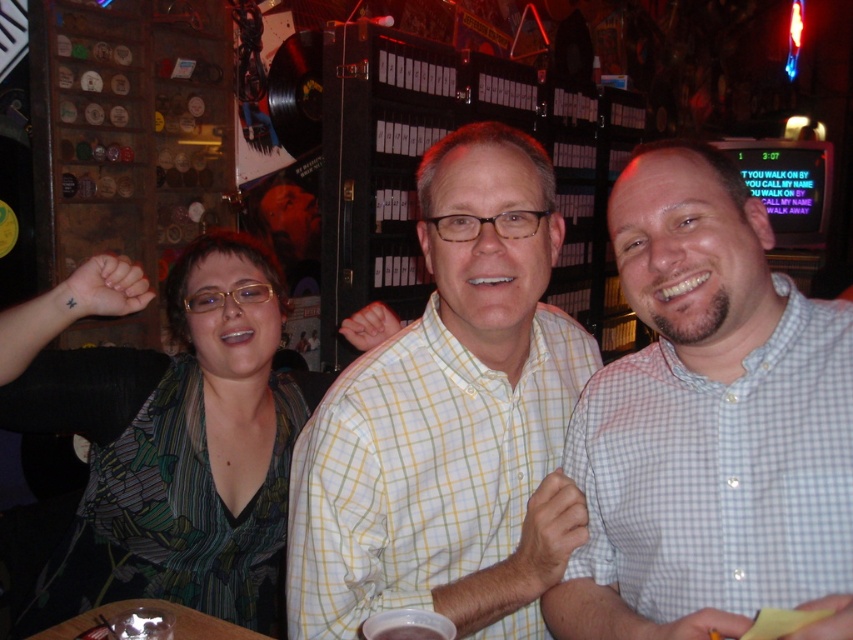
Between yellow checkered shirt at center and green printed dress at center, which one is positioned higher?

Positioned higher is yellow checkered shirt at center.

Is point (395, 548) more distant than point (274, 586)?

No, it is not.

Identify the location of yellow checkered shirt at center. This screenshot has height=640, width=853. (450, 420).

Does white checkered shirt at center have a greater height compared to green printed dress at center?

In fact, white checkered shirt at center may be shorter than green printed dress at center.

Looking at this image, does white checkered shirt at center appear over green printed dress at center?

Correct, white checkered shirt at center is located above green printed dress at center.

Locate an element on the screen. white checkered shirt at center is located at coordinates (709, 424).

Image resolution: width=853 pixels, height=640 pixels. Find the location of `white checkered shirt at center`. white checkered shirt at center is located at coordinates (709, 424).

Who is positioned more to the left, white checkered shirt at center or yellow checkered shirt at center?

Positioned to the left is yellow checkered shirt at center.

Is white checkered shirt at center positioned before yellow checkered shirt at center?

Yes.

Who is more forward, (755, 225) or (439, 506)?

Positioned in front is point (755, 225).

You are a GUI agent. You are given a task and a screenshot of the screen. Output one action in this format:
    pyautogui.click(x=<x>, y=<y>)
    Task: Click on the white checkered shirt at center
    Image resolution: width=853 pixels, height=640 pixels.
    Given the screenshot: What is the action you would take?
    pyautogui.click(x=709, y=424)